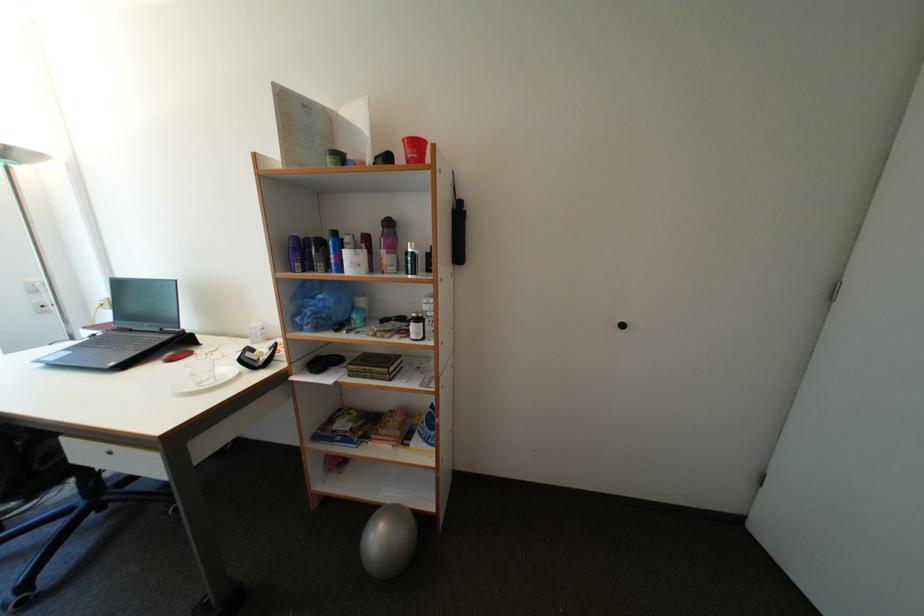
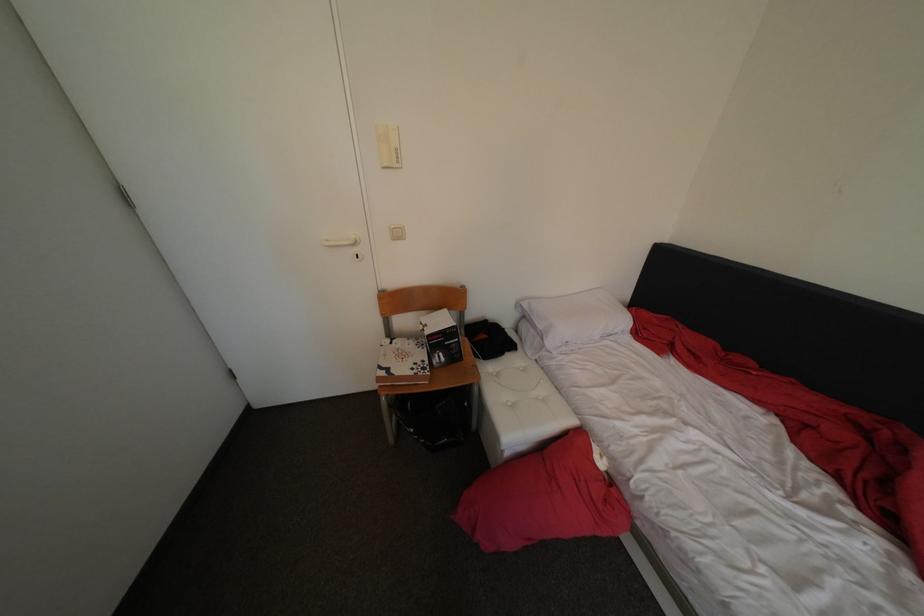
Based on the continuous images, in which direction is the camera rotating?

The camera rotated toward right-down.